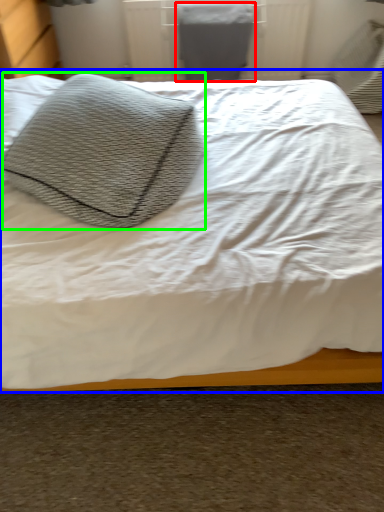
Question: Which is farther away from gray (highlighted by a red box)? bed (highlighted by a blue box) or throw pillow (highlighted by a green box)?

Choices:
 (A) bed
 (B) throw pillow

Answer: (B)